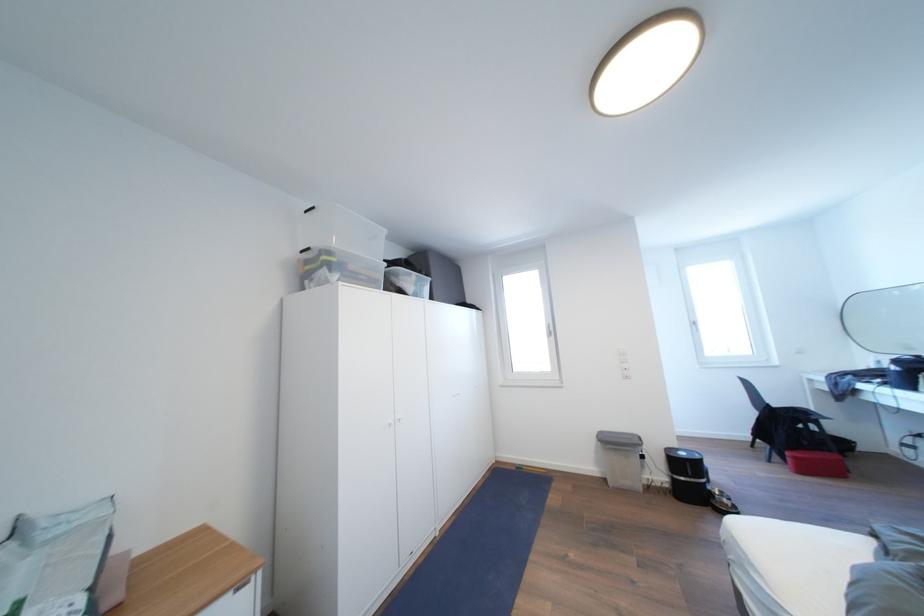
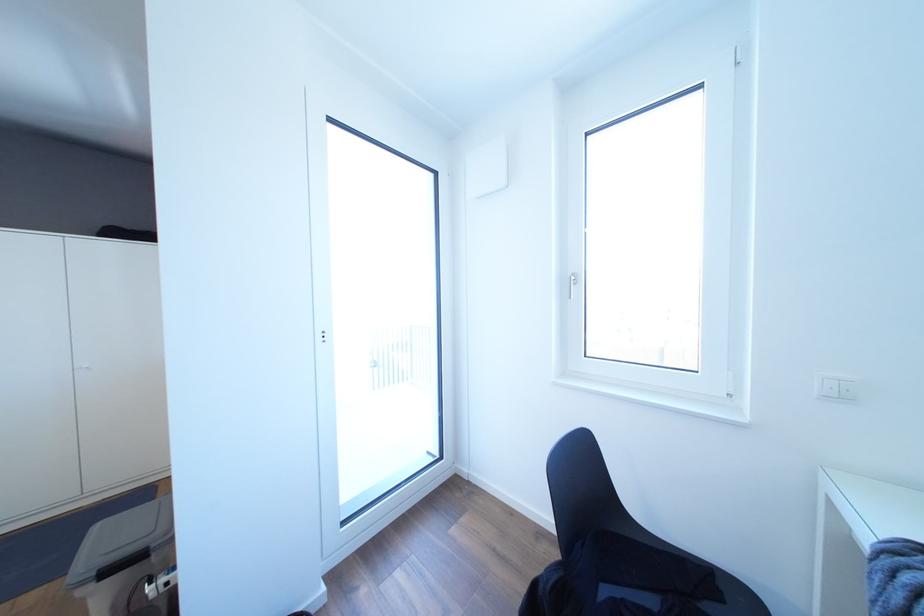
Based on the photo, in a continuous first-person perspective shot, in which direction is the camera moving?

The cameraman moved toward right, forward.